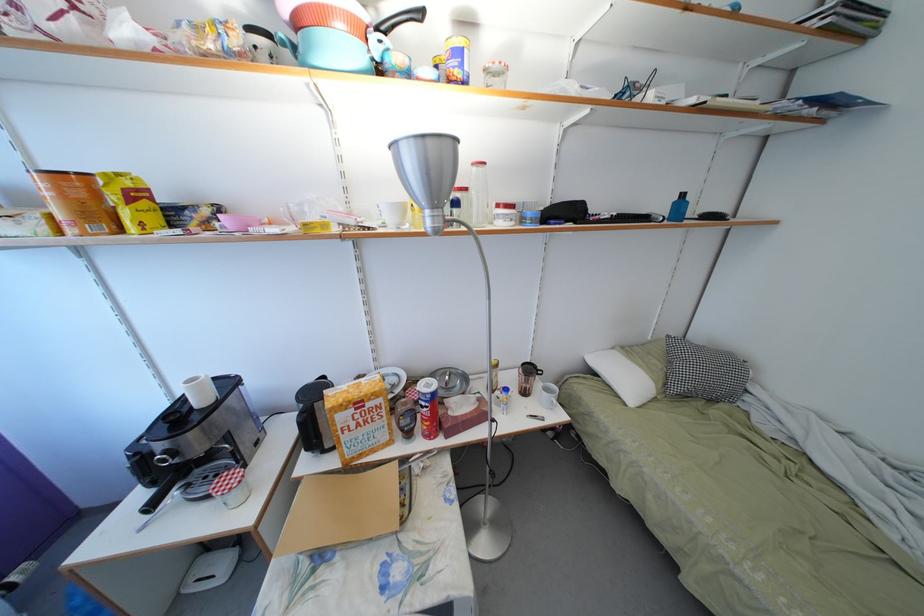
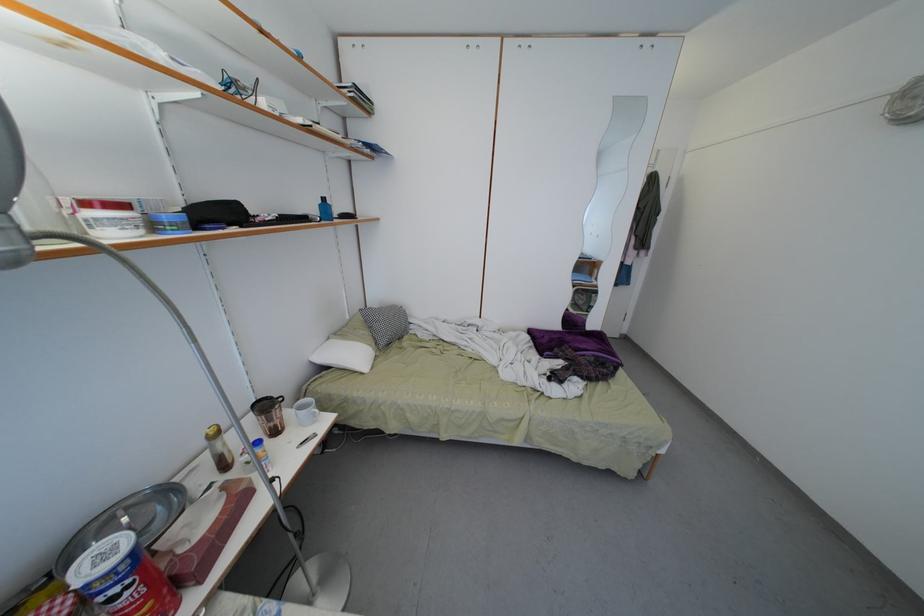
Find the pixel in the second image that matches the point at 495,305 in the first image.

(201, 347)